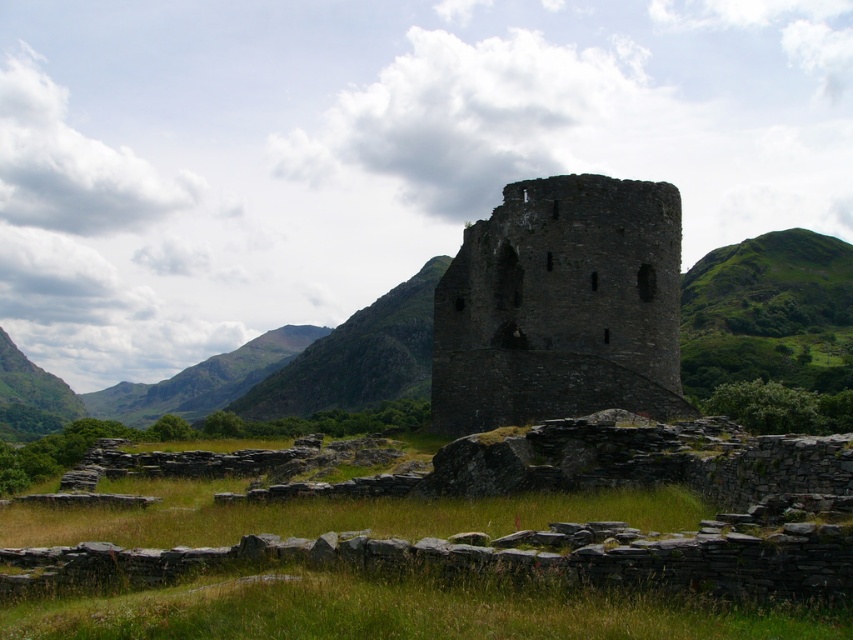
Question: Which object appears farthest from the camera in this image?

Choices:
 (A) dark gray stone tower at center
 (B) green grassy hill at center

Answer: (B)

Question: Can you confirm if green grass at center is positioned below dark gray stone tower at center?

Choices:
 (A) no
 (B) yes

Answer: (B)

Question: Does green grass at center come behind green grassy hill at center?

Choices:
 (A) yes
 (B) no

Answer: (B)

Question: Does green grass at center appear under dark gray stone tower at center?

Choices:
 (A) no
 (B) yes

Answer: (B)

Question: Estimate the real-world distances between objects in this image. Which object is closer to the dark gray stone tower at center?

Choices:
 (A) green grass at center
 (B) green grassy hill at center

Answer: (A)

Question: Among these points, which one is farthest from the camera?

Choices:
 (A) (569, 305)
 (B) (747, 515)

Answer: (A)